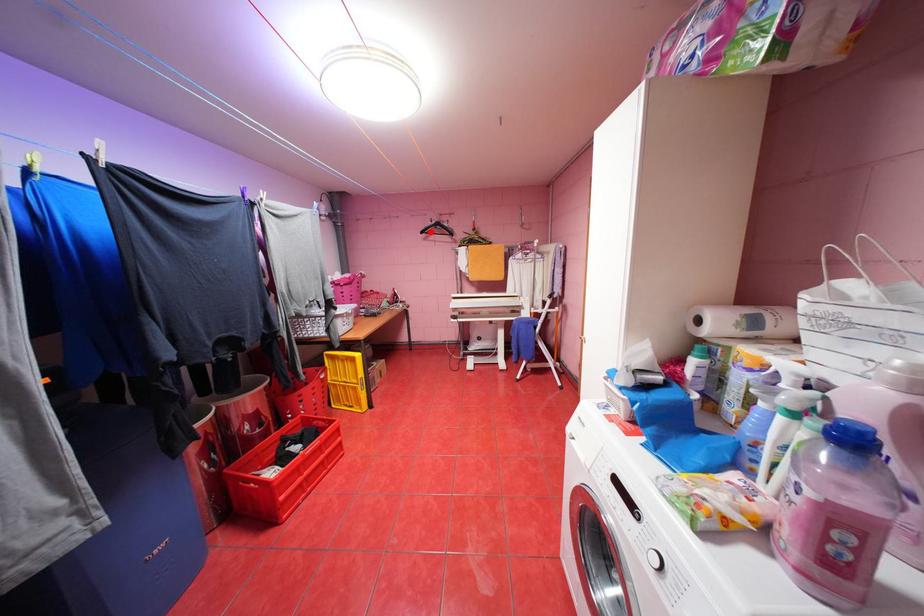
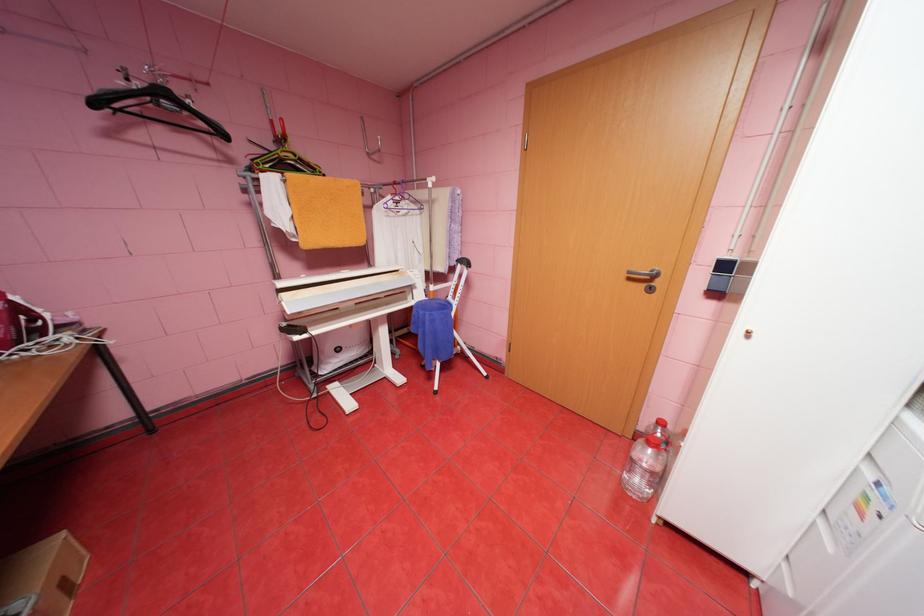
Find the pixel in the second image that matches the highlighted location in the first image.

(103, 103)